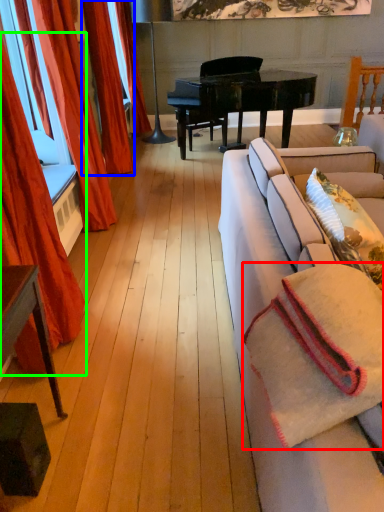
Question: Which object is the closest to the blanket (highlighted by a red box)? Choose among these: curtain (highlighted by a blue box) or curtain (highlighted by a green box).

Choices:
 (A) curtain
 (B) curtain

Answer: (B)